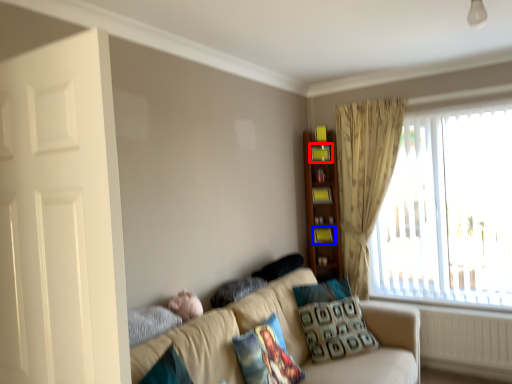
Question: Which object appears farthest to the camera in this image, shelf (highlighted by a red box) or shelf (highlighted by a blue box)?

Choices:
 (A) shelf
 (B) shelf

Answer: (B)